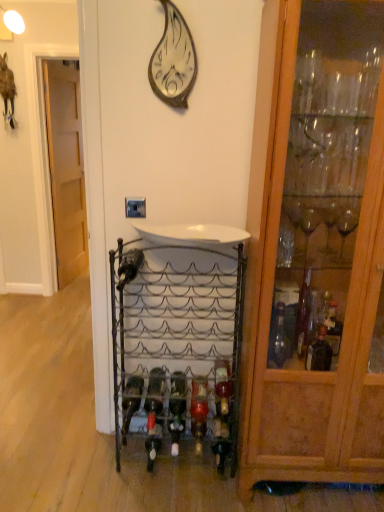
Image resolution: width=384 pixels, height=512 pixels. In order to click on wooden cabinet at right in this screenshot , I will do `click(314, 247)`.

I want to click on white glossy sink at center, so click(191, 234).

You are a GUI agent. You are given a task and a screenshot of the screen. Output one action in this format:
    pyautogui.click(x=<x>, y=<y>)
    Task: Click on the metallic silver wall clock at upper center
    This screenshot has height=512, width=384.
    Given the screenshot: What is the action you would take?
    pyautogui.click(x=173, y=60)

Image resolution: width=384 pixels, height=512 pixels. What do you see at coordinates (173, 60) in the screenshot? I see `metallic silver wall clock at upper center` at bounding box center [173, 60].

The width and height of the screenshot is (384, 512). Identify the location of light brown wood door at left. (66, 169).

Where is `wooden cabinet at right`? The width and height of the screenshot is (384, 512). wooden cabinet at right is located at coordinates (314, 247).

Is wooden cabinet at right aimed at white glossy sink at center?

No, wooden cabinet at right is not oriented towards white glossy sink at center.

Is wooden cabinet at right completely or partially outside of white glossy sink at center?

Yes, wooden cabinet at right is not within white glossy sink at center.

From the image's perspective, between wooden cabinet at right and white glossy sink at center, which one is located above?

white glossy sink at center, from the image's perspective.

From a real-world perspective, which is physically above, wooden cabinet at right or white glossy sink at center?

white glossy sink at center.

Does point (51, 103) come behind point (159, 231)?

Yes, it is behind point (159, 231).

From the image's perspective, which one is positioned higher, light brown wood door at left or white glossy sink at center?

From the image's view, light brown wood door at left is above.

The image size is (384, 512). What are the coordinates of `sink that is above the light brown wood door at left (from a real-world perspective)` in the screenshot? It's located at (191, 234).

From a real-world perspective, is light brown wood door at left under white glossy sink at center?

Correct, in the physical world, light brown wood door at left is lower than white glossy sink at center.

Is metallic silver wall clock at upper center oriented away from wooden cabinet at right?

No, metallic silver wall clock at upper center is not facing away from wooden cabinet at right.

From the image's perspective, which is below, metallic silver wall clock at upper center or wooden cabinet at right?

wooden cabinet at right is shown below in the image.

In the image, is metallic silver wall clock at upper center positioned in front of or behind wooden cabinet at right?

Clearly, metallic silver wall clock at upper center is behind wooden cabinet at right.

Is metallic wine rack at center not near white glossy sink at center?

No, metallic wine rack at center is in close proximity to white glossy sink at center.

From a real-world perspective, is metallic wine rack at center above or below white glossy sink at center?

In terms of real-world spatial position, metallic wine rack at center is below white glossy sink at center.

Can we say metallic wine rack at center lies outside white glossy sink at center?

Yes.

I want to click on shelf below the white glossy sink at center (from the image's perspective), so point(174,344).

Is metallic silver wall clock at upper center placed right next to metallic wine rack at center?

No, metallic silver wall clock at upper center is not beside metallic wine rack at center.

Which is more to the right, metallic silver wall clock at upper center or metallic wine rack at center?

Positioned to the right is metallic wine rack at center.

Is metallic silver wall clock at upper center situated inside metallic wine rack at center or outside?

metallic silver wall clock at upper center is not enclosed by metallic wine rack at center.

This screenshot has width=384, height=512. In order to click on shelf that appears below the metallic silver wall clock at upper center (from the image's perspective) in this screenshot , I will do `click(174, 344)`.

From their relative heights in the image, would you say wooden cabinet at right is taller or shorter than metallic silver wall clock at upper center?

In the image, wooden cabinet at right appears to be taller than metallic silver wall clock at upper center.

Can you tell me how much wooden cabinet at right and metallic silver wall clock at upper center differ in facing direction?

The facing directions of wooden cabinet at right and metallic silver wall clock at upper center are 1.32 degrees apart.

This screenshot has height=512, width=384. Find the location of `wall clock above the wooden cabinet at right (from the image's perspective)`. wall clock above the wooden cabinet at right (from the image's perspective) is located at coordinates (173, 60).

From the image's perspective, who appears lower, wooden cabinet at right or metallic silver wall clock at upper center?

wooden cabinet at right is shown below in the image.

From the picture: Considering the positions of objects white glossy sink at center and metallic silver wall clock at upper center in the image provided, who is behind, white glossy sink at center or metallic silver wall clock at upper center?

white glossy sink at center.

Is metallic silver wall clock at upper center at the back of white glossy sink at center?

No, white glossy sink at center is not facing the opposite direction of metallic silver wall clock at upper center.

Considering the sizes of objects white glossy sink at center and metallic silver wall clock at upper center in the image provided, who is shorter, white glossy sink at center or metallic silver wall clock at upper center?

white glossy sink at center is shorter.

From a real-world perspective, is white glossy sink at center located higher than metallic silver wall clock at upper center?

No.

Find the location of `sink that appears on the left of wooden cabinet at right`. sink that appears on the left of wooden cabinet at right is located at coordinates (191, 234).

What are the coordinates of `sink in front of the light brown wood door at left` in the screenshot? It's located at (191, 234).

Looking at this image, looking at the image, which one is located closer to white glossy sink at center, metallic silver wall clock at upper center or metallic wine rack at center?

metallic wine rack at center lies closer to white glossy sink at center than the other object.

Which object lies further to the anchor point wooden cabinet at right, metallic silver wall clock at upper center or light brown wood door at left?

The object further to wooden cabinet at right is light brown wood door at left.

Estimate the real-world distances between objects in this image. Which object is closer to metallic silver wall clock at upper center, wooden cabinet at right or white glossy sink at center?

Based on the image, white glossy sink at center appears to be nearer to metallic silver wall clock at upper center.

Looking at the image, which one is located further to wooden cabinet at right, metallic silver wall clock at upper center or metallic wine rack at center?

Based on the image, metallic silver wall clock at upper center appears to be further to wooden cabinet at right.

From the picture: Looking at the image, which one is located closer to light brown wood door at left, wooden cabinet at right or white glossy sink at center?

The object closer to light brown wood door at left is white glossy sink at center.

When comparing their distances from white glossy sink at center, does metallic wine rack at center or metallic silver wall clock at upper center seem further?

metallic silver wall clock at upper center.

Which object lies nearer to the anchor point light brown wood door at left, wooden cabinet at right or metallic wine rack at center?

Based on the image, metallic wine rack at center appears to be nearer to light brown wood door at left.

Looking at the image, which one is located further to wooden cabinet at right, white glossy sink at center or metallic silver wall clock at upper center?

metallic silver wall clock at upper center.

Find the location of a particular element. The height and width of the screenshot is (512, 384). shelf between wooden cabinet at right and light brown wood door at left from front to back is located at coordinates (174, 344).

Where is `cabinetry between metallic silver wall clock at upper center and metallic wine rack at center in the vertical direction`? cabinetry between metallic silver wall clock at upper center and metallic wine rack at center in the vertical direction is located at coordinates (314, 247).

You are a GUI agent. You are given a task and a screenshot of the screen. Output one action in this format:
    pyautogui.click(x=<x>, y=<y>)
    Task: Click on the sink positioned between metallic silver wall clock at upper center and light brown wood door at left from near to far
    The height and width of the screenshot is (512, 384).
    Given the screenshot: What is the action you would take?
    pyautogui.click(x=191, y=234)

What are the coordinates of `sink between metallic silver wall clock at upper center and wooden cabinet at right from top to bottom` in the screenshot? It's located at (191, 234).